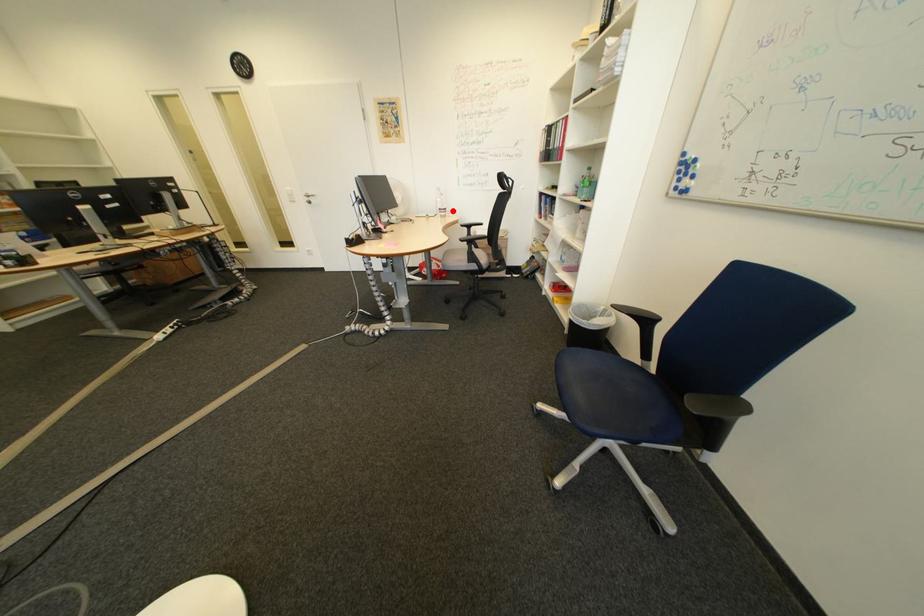
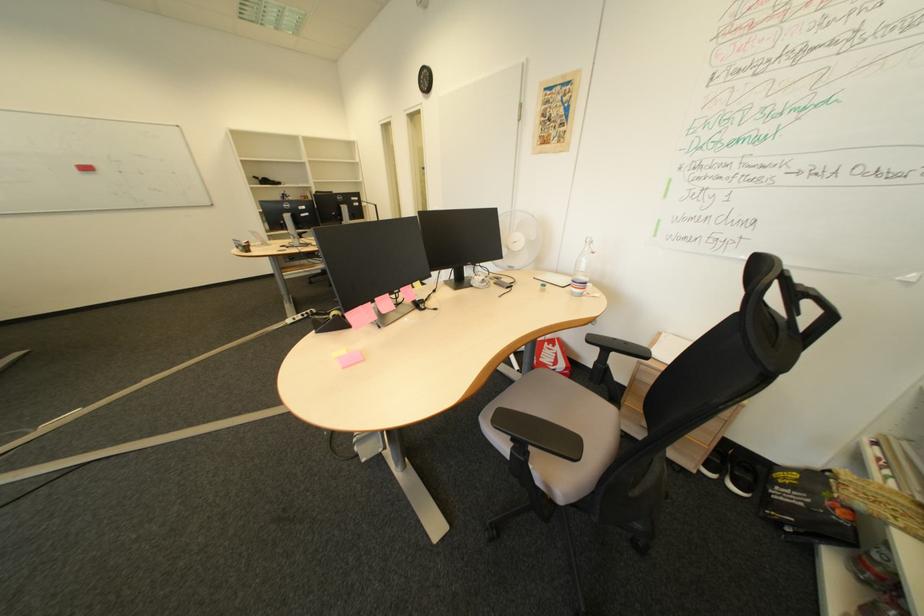
In the second image, find the point that corresponds to the highlighted location in the first image.

(587, 282)